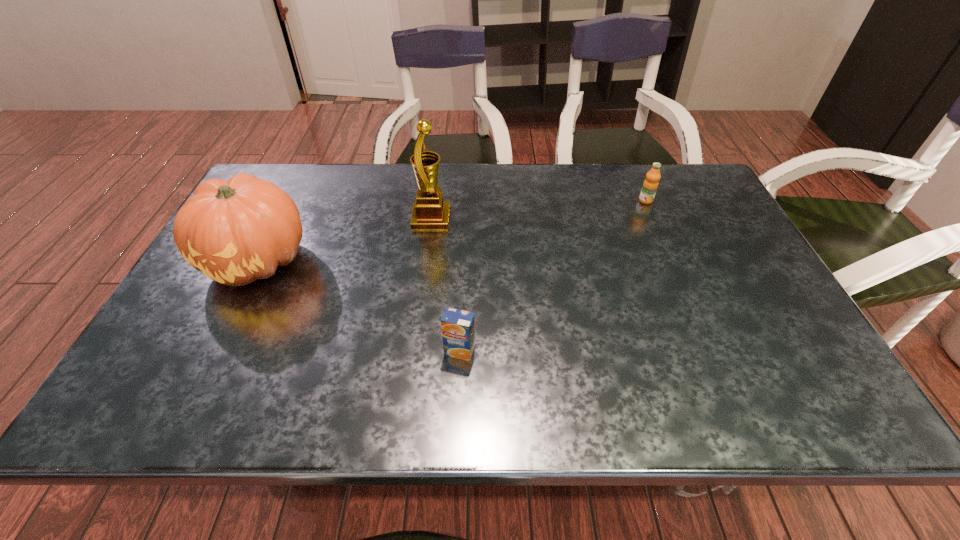
At what (x,y) coordinates should I click in order to perform the action: click on free space at the far right corner of the desktop. Please return your answer as a coordinate pair (x, y). Image resolution: width=960 pixels, height=540 pixels. Looking at the image, I should click on (662, 171).

You are a GUI agent. You are given a task and a screenshot of the screen. Output one action in this format:
    pyautogui.click(x=<x>, y=<y>)
    Task: Click on the vacant region at the near right corner of the desktop
    The height and width of the screenshot is (540, 960).
    Given the screenshot: What is the action you would take?
    pyautogui.click(x=774, y=397)

Find the location of `free space between the farther orange_juice and the tallest object`. free space between the farther orange_juice and the tallest object is located at coordinates (539, 210).

Locate an element on the screen. Image resolution: width=960 pixels, height=540 pixels. vacant area that lies between the farthest object and the award is located at coordinates (539, 210).

Find the location of a particular element. vacant area that lies between the nearer orange_juice and the farthest object is located at coordinates (553, 276).

Where is `empty space that is in between the leftmost object and the rightmost object`? This screenshot has height=540, width=960. empty space that is in between the leftmost object and the rightmost object is located at coordinates (452, 231).

Find the location of a particular element. This screenshot has height=540, width=960. vacant space that is in between the leftmost object and the left orange_juice is located at coordinates (359, 306).

In order to click on empty space that is in between the nearest object and the award in this screenshot , I will do `click(445, 285)`.

Locate an element on the screen. unoccupied position between the nearest object and the farthest object is located at coordinates (553, 276).

At what (x,y) coordinates should I click in order to perform the action: click on free space between the award and the pumpkin. Please return your answer as a coordinate pair (x, y). Image resolution: width=960 pixels, height=540 pixels. Looking at the image, I should click on (345, 239).